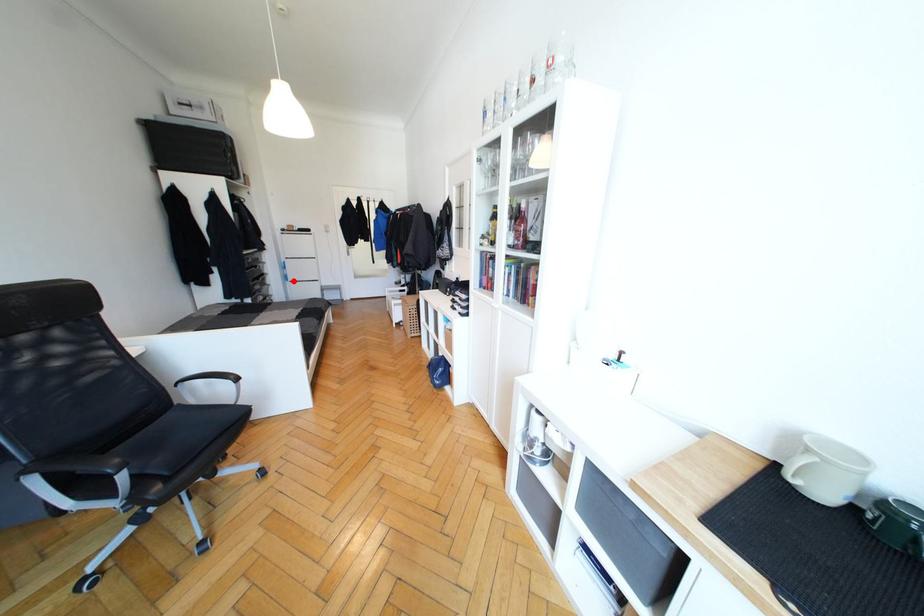
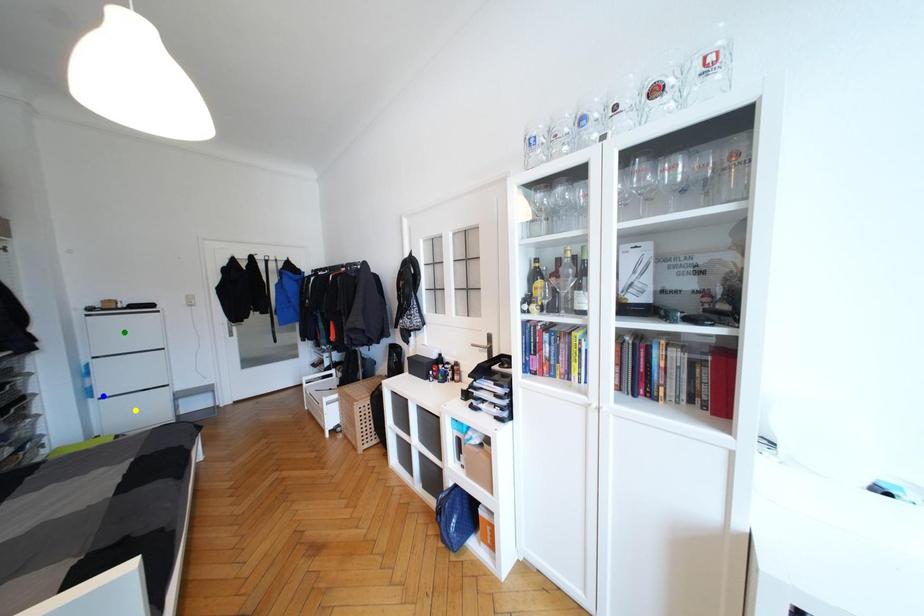
Question: I am providing you with two images of the same scene from different viewpoints. A red point is marked on the first image. You are given multiple points on the second image. Can you choose the point in image 2 that corresponds to the point in image 1?

Choices:
 (A) blue point
 (B) green point
 (C) yellow point

Answer: (A)